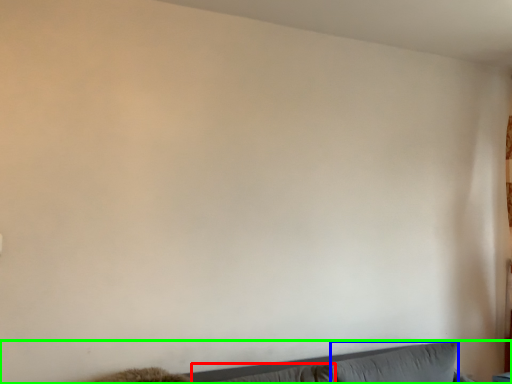
Question: Considering the real-world distances, which object is closest to pillow (highlighted by a red box)? pillow (highlighted by a blue box) or couch (highlighted by a green box).

Choices:
 (A) pillow
 (B) couch

Answer: (B)